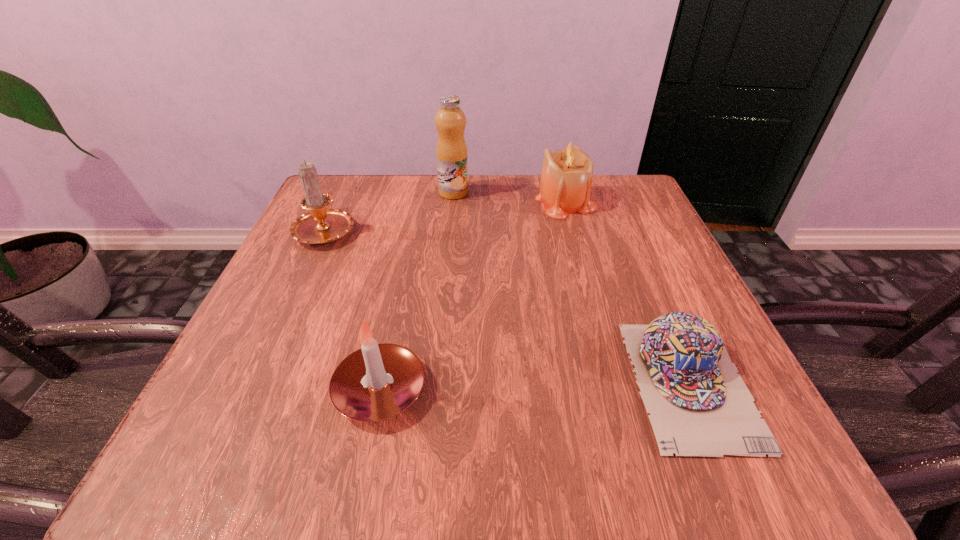
You are a GUI agent. You are given a task and a screenshot of the screen. Output one action in this format:
    pyautogui.click(x=<x>, y=<y>)
    Task: Click on the fruit juice
    
    Given the screenshot: What is the action you would take?
    pyautogui.click(x=451, y=151)

At what (x,y) coordinates should I click in order to perform the action: click on the leftmost candle. Please return your answer as a coordinate pair (x, y). The height and width of the screenshot is (540, 960). Looking at the image, I should click on (321, 225).

This screenshot has width=960, height=540. I want to click on the rightmost candle, so pos(566,180).

Find the location of a particular element. The image size is (960, 540). the second candle from left to right is located at coordinates (379, 381).

The image size is (960, 540). I want to click on cap, so click(699, 406).

The width and height of the screenshot is (960, 540). What are the coordinates of `free space located 0.120m on the front label of the fruit juice` in the screenshot? It's located at (518, 193).

What are the coordinates of `vacant space located 0.330m on the right of the leftmost object` in the screenshot? It's located at (512, 229).

Locate an element on the screen. The width and height of the screenshot is (960, 540). vacant space situated on the left of the rightmost candle is located at coordinates (401, 201).

Image resolution: width=960 pixels, height=540 pixels. I want to click on free spot located 0.270m on the right of the second candle from right to left, so click(613, 390).

Locate an element on the screen. fruit juice situated at the far edge is located at coordinates (451, 151).